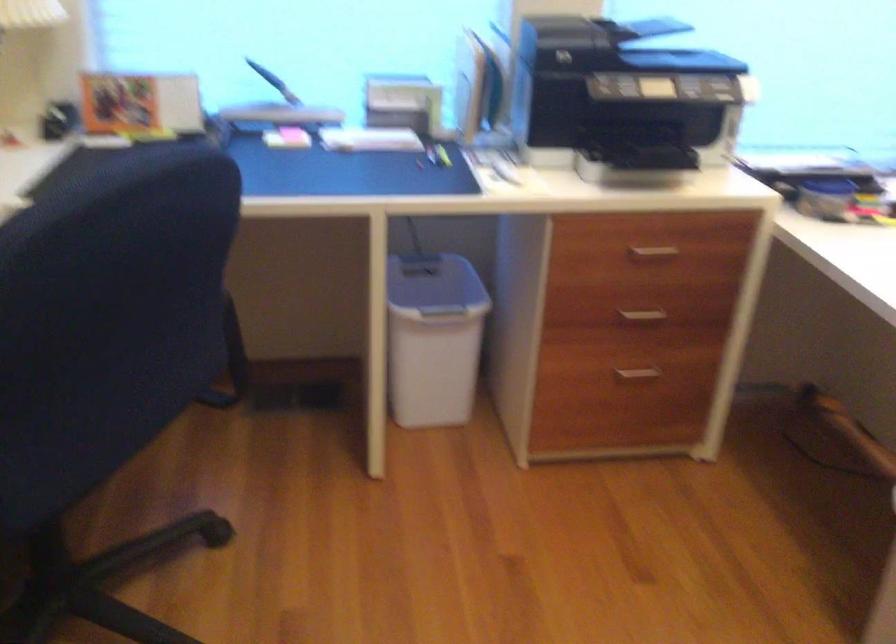
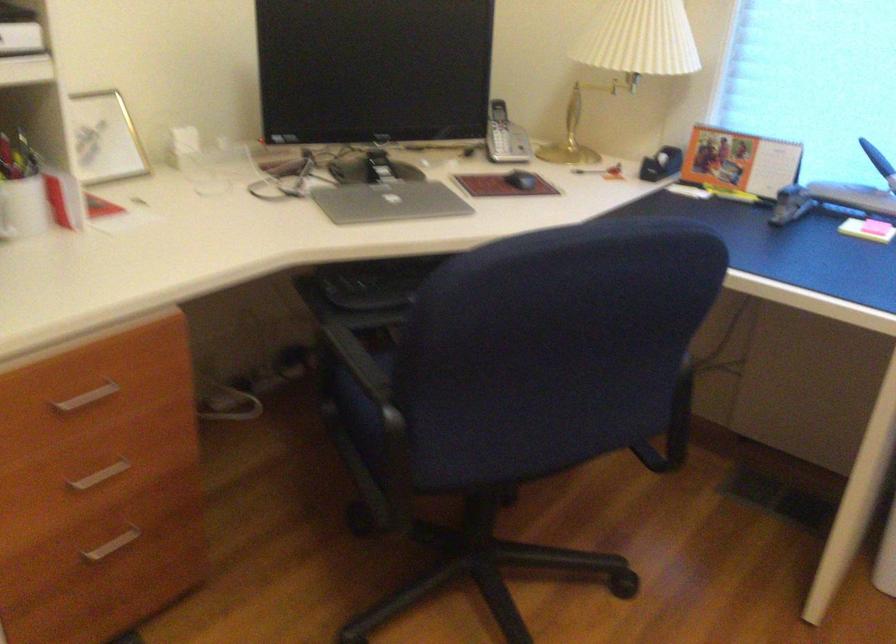
Find the pixel in the second image that matches pixel 143 99 in the first image.

(739, 162)